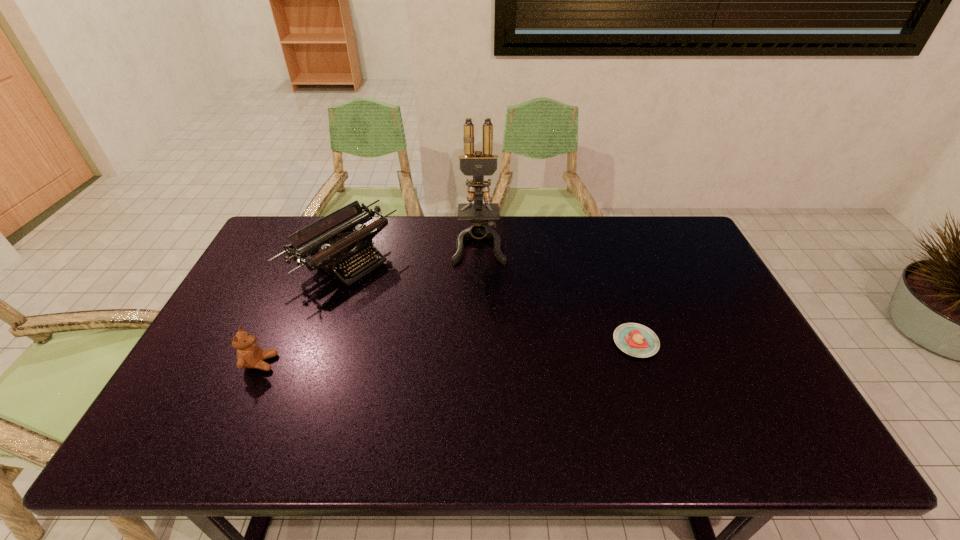
I want to click on free space located 0.380m at the eyepieces of the third object from left to right, so click(481, 359).

This screenshot has width=960, height=540. Find the location of `free space located 0.260m on the typing side of the second tallest object`. free space located 0.260m on the typing side of the second tallest object is located at coordinates (438, 326).

I want to click on vacant space located on the typing side of the second tallest object, so click(388, 292).

Where is `blank space located 0.390m on the typing side of the second tallest object`? blank space located 0.390m on the typing side of the second tallest object is located at coordinates (473, 349).

Identify the location of microscope situated at the far edge. (478, 165).

Where is `typewriter that is positioned at the far edge`? The image size is (960, 540). typewriter that is positioned at the far edge is located at coordinates (341, 246).

In order to click on teddy bear present at the left edge in this screenshot , I will do `click(249, 354)`.

Find the location of a particular element. typewriter present at the left edge is located at coordinates (341, 246).

Locate an element on the screen. This screenshot has height=540, width=960. object that is at the far left corner is located at coordinates (341, 246).

This screenshot has height=540, width=960. I want to click on blank space at the far edge of the desktop, so click(639, 253).